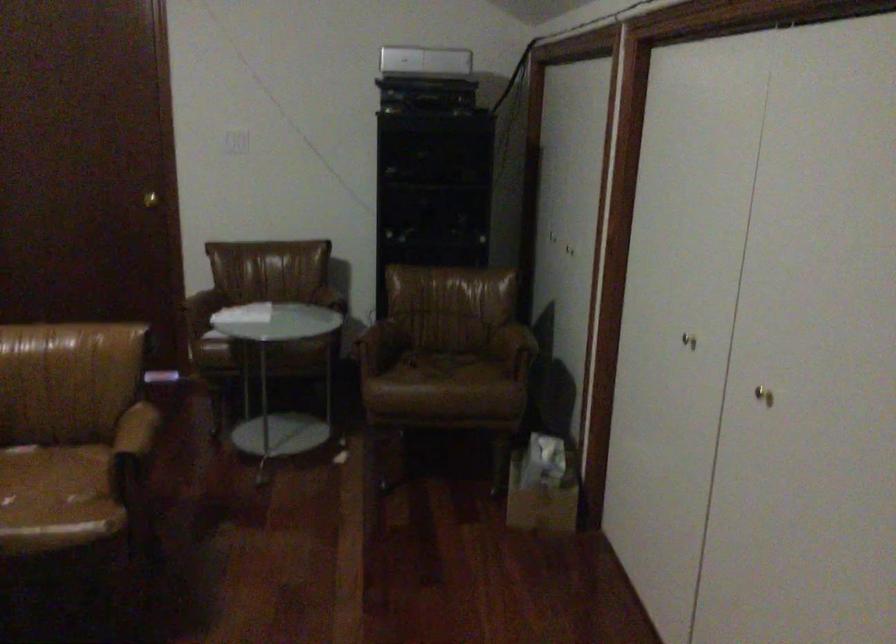
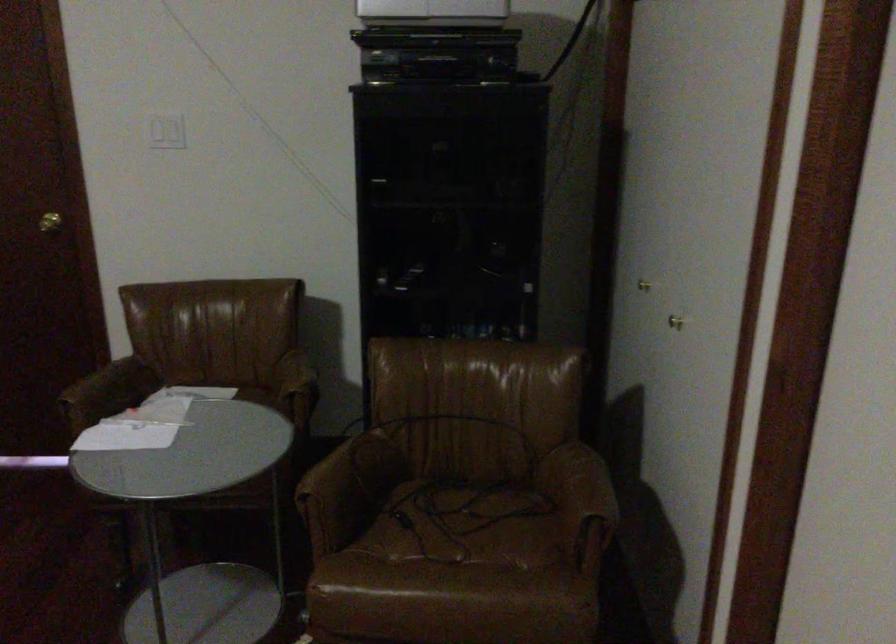
Where in the second image is the point corresponding to (x=357, y=353) from the first image?

(312, 513)